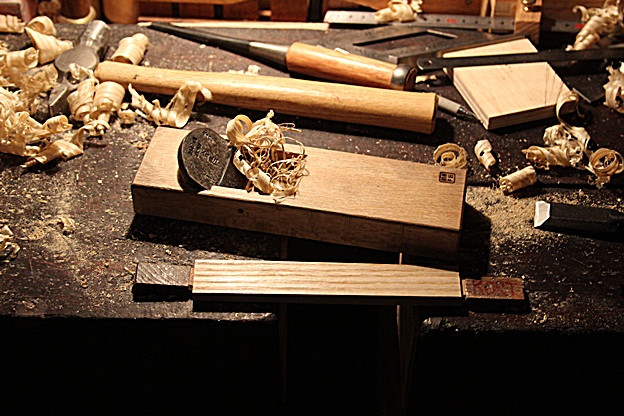
Locate an element on the screen. This screenshot has width=624, height=416. black workbench top is located at coordinates (95, 205).